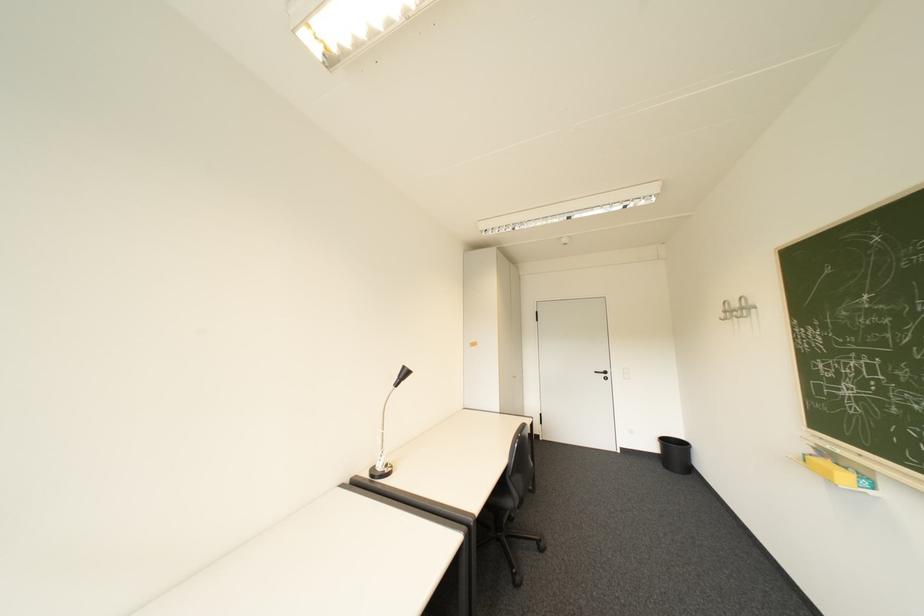
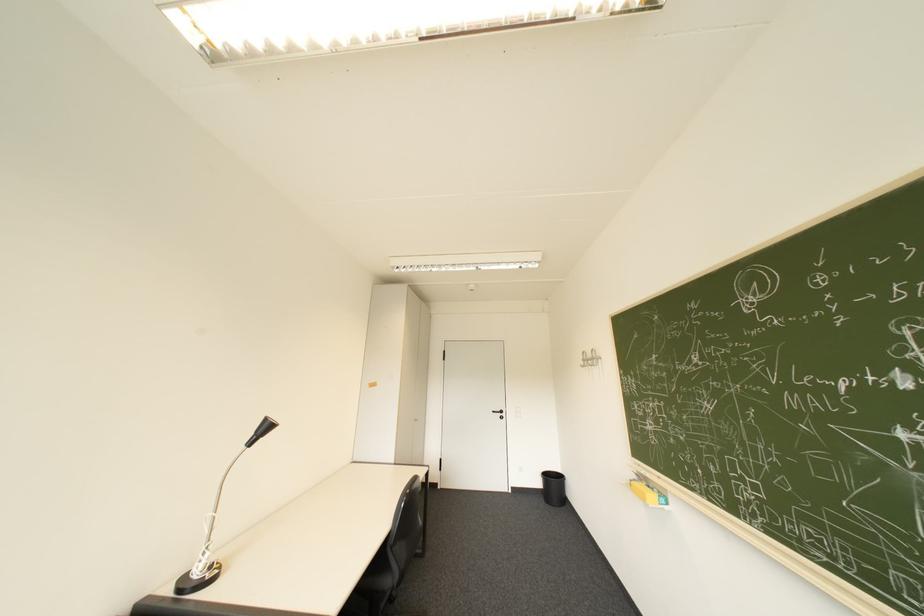
In the second image, find the point that corresponds to point (605, 373) in the first image.

(504, 411)